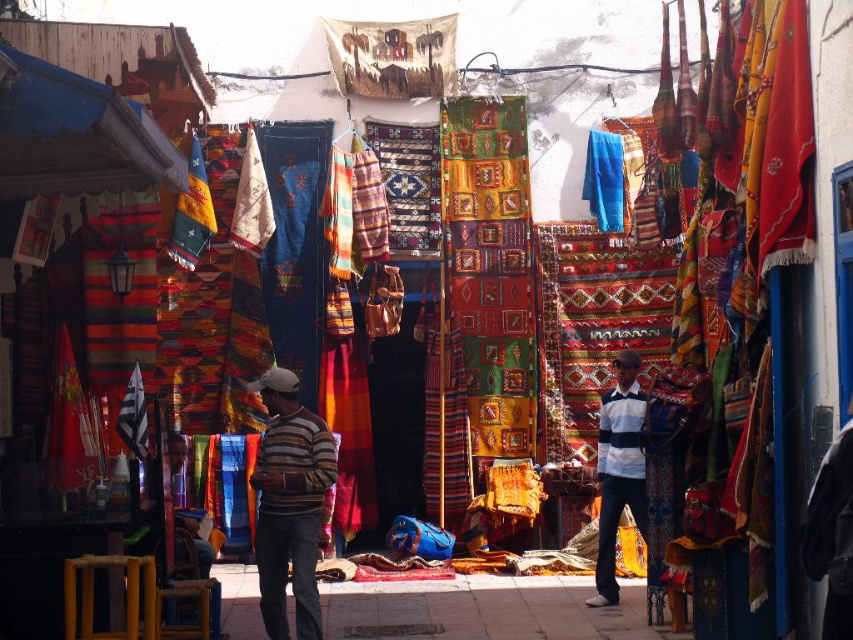
Question: Is striped cotton sweater at center smaller than white striped shirt at center?

Choices:
 (A) no
 (B) yes

Answer: (B)

Question: Is striped cotton sweater at center wider than white striped shirt at center?

Choices:
 (A) yes
 (B) no

Answer: (A)

Question: Which point appears closest to the camera in this image?

Choices:
 (A) (643, 513)
 (B) (332, 442)

Answer: (B)

Question: Is striped cotton sweater at center above white striped shirt at center?

Choices:
 (A) no
 (B) yes

Answer: (B)